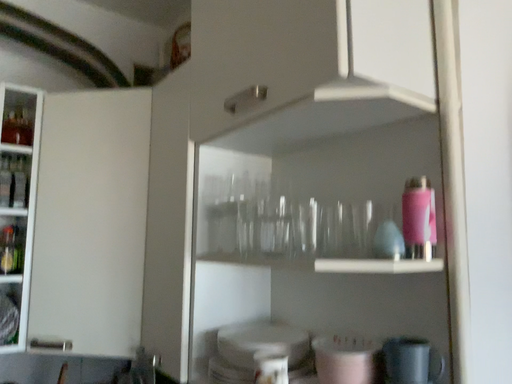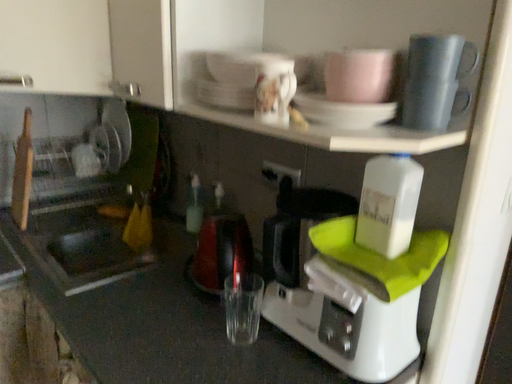
Question: How did the camera likely rotate when shooting the video?

Choices:
 (A) rotated upward
 (B) rotated downward

Answer: (B)